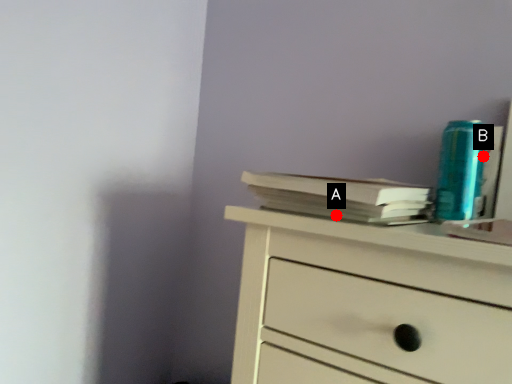
Question: Two points are circled on the image, labeled by A and B beside each circle. Which point appears closest to the camera in this image?

Choices:
 (A) A is closer
 (B) B is closer

Answer: (A)